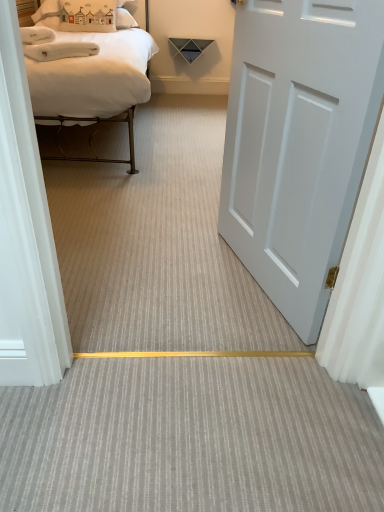
Question: Is gray textured carpet at center positioned far away from white matte door at right?

Choices:
 (A) yes
 (B) no

Answer: (B)

Question: Can you confirm if gray textured carpet at center is bigger than white matte door at right?

Choices:
 (A) yes
 (B) no

Answer: (B)

Question: From a real-world perspective, is gray textured carpet at center physically below white matte door at right?

Choices:
 (A) yes
 (B) no

Answer: (A)

Question: Could you tell me if gray textured carpet at center is facing white matte door at right?

Choices:
 (A) no
 (B) yes

Answer: (A)

Question: Is gray textured carpet at center in contact with white matte door at right?

Choices:
 (A) no
 (B) yes

Answer: (A)

Question: From the image's perspective, is white matte door at right positioned above or below gray textured carpet at center?

Choices:
 (A) below
 (B) above

Answer: (B)

Question: Does point (360, 22) appear closer or farther from the camera than point (49, 484)?

Choices:
 (A) closer
 (B) farther

Answer: (A)

Question: From a real-world perspective, is white matte door at right physically located above or below gray textured carpet at center?

Choices:
 (A) below
 (B) above

Answer: (B)

Question: From their relative heights in the image, would you say white matte door at right is taller or shorter than gray textured carpet at center?

Choices:
 (A) short
 (B) tall

Answer: (B)

Question: Considering the positions of white matte door at right and white matte bed at upper left in the image, is white matte door at right wider or thinner than white matte bed at upper left?

Choices:
 (A) thin
 (B) wide

Answer: (A)

Question: Is point (248, 73) closer or farther from the camera than point (33, 74)?

Choices:
 (A) closer
 (B) farther

Answer: (A)

Question: Is white matte door at right spatially inside white matte bed at upper left, or outside of it?

Choices:
 (A) inside
 (B) outside

Answer: (B)

Question: In terms of height, does white matte door at right look taller or shorter compared to white matte bed at upper left?

Choices:
 (A) short
 (B) tall

Answer: (B)

Question: Would you say white fabric pillow at upper left is to the left or to the right of white matte door at right in the picture?

Choices:
 (A) right
 (B) left

Answer: (B)

Question: From the image's perspective, relative to white matte door at right, is white fabric pillow at upper left above or below?

Choices:
 (A) below
 (B) above

Answer: (B)